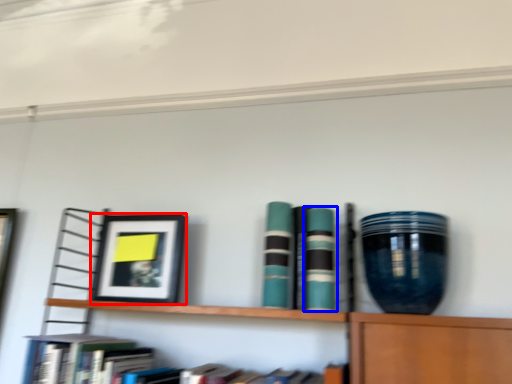
Question: Among these objects, which one is farthest to the camera, picture frame (highlighted by a red box) or book (highlighted by a blue box)?

Choices:
 (A) picture frame
 (B) book

Answer: (A)